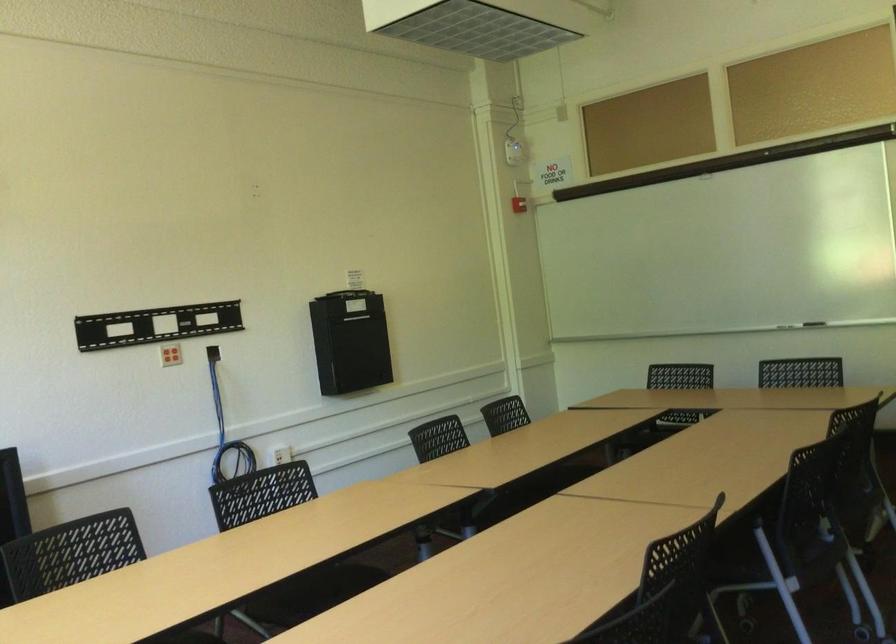
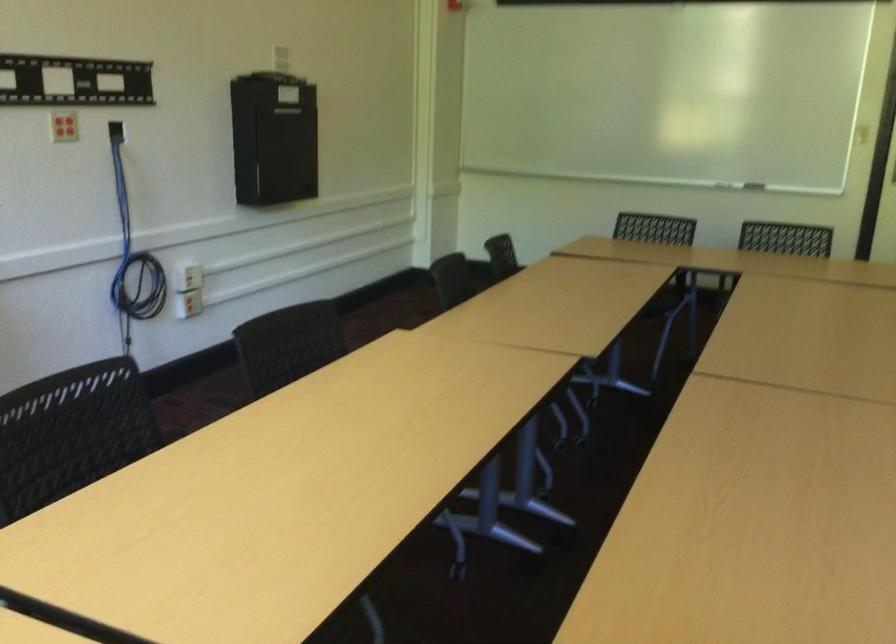
Question: I am providing you with two images of the same scene from different viewpoints. Which of the following objects are not visible in image2?

Choices:
 (A) black box door
 (B) patterned flower pot
 (C) blue coiled cable
 (D) black chair sitting surface

Answer: (D)